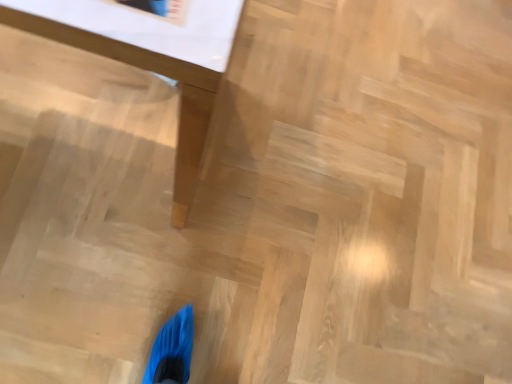
Identify the location of vacant region to the right of wooden table at upper left. (243, 227).